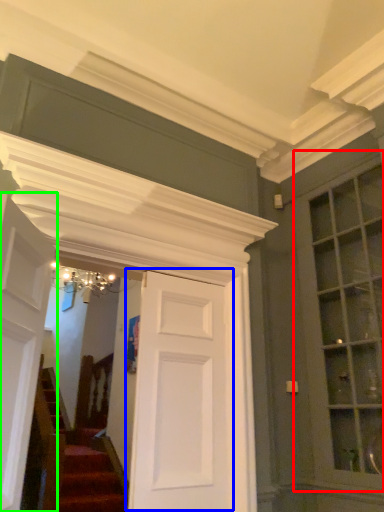
Question: Estimate the real-world distances between objects in this image. Which object is farther from window (highlighted by a red box), door (highlighted by a blue box) or door (highlighted by a green box)?

Choices:
 (A) door
 (B) door

Answer: (B)